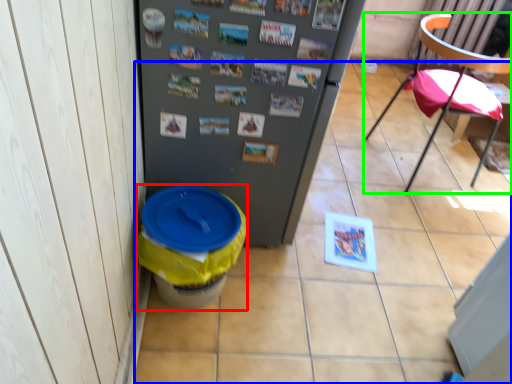
Question: Considering the real-world distances, which object is closest to potty (highlighted by a red box)? tile (highlighted by a blue box) or chair (highlighted by a green box).

Choices:
 (A) tile
 (B) chair

Answer: (A)